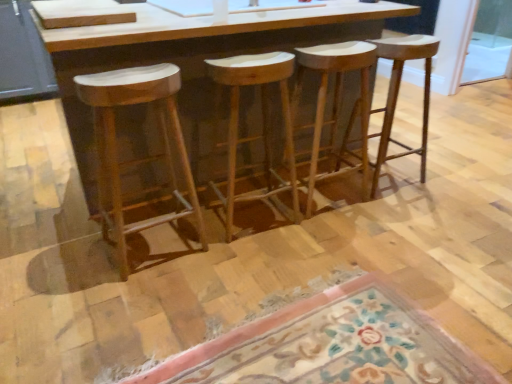
Find the location of `vacant space to the right of natural wood stool at center, which ranks as the third stool in left-to-right order`. vacant space to the right of natural wood stool at center, which ranks as the third stool in left-to-right order is located at coordinates (383, 208).